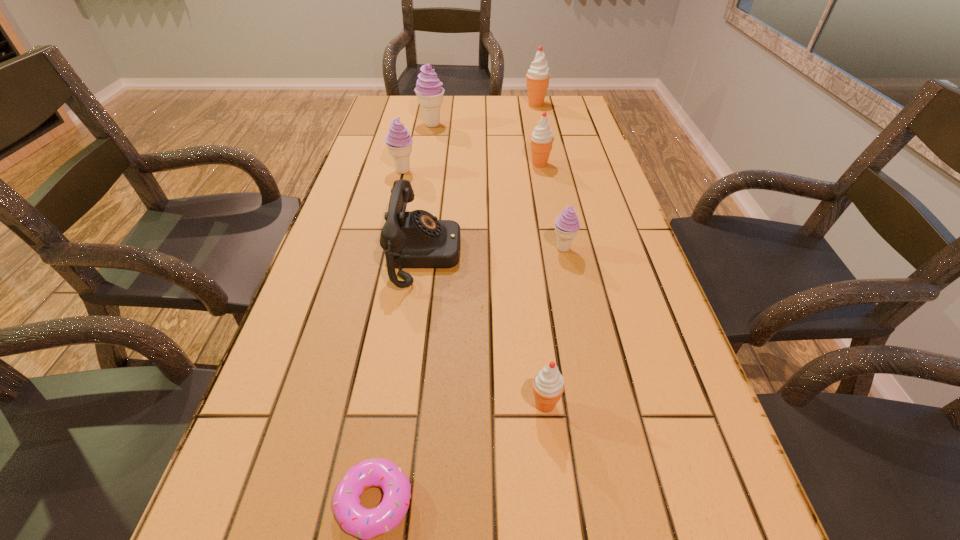
Image resolution: width=960 pixels, height=540 pixels. Find the location of `the nearest icecream`. the nearest icecream is located at coordinates (548, 384).

Find the location of `free location located 0.330m on the left of the farthest object`. free location located 0.330m on the left of the farthest object is located at coordinates (438, 104).

I want to click on vacant region located 0.160m on the back of the biggest purple icecream, so click(436, 101).

Locate an element on the screen. The height and width of the screenshot is (540, 960). free space located 0.140m on the back of the second farthest purple icecream is located at coordinates (410, 143).

The image size is (960, 540). I want to click on vacant space located on the left of the second smallest red icecream, so click(492, 164).

The height and width of the screenshot is (540, 960). I want to click on free location located 0.320m on the dial of the gray telephone, so click(593, 254).

This screenshot has height=540, width=960. Identify the location of free location located on the front of the rightmost purple icecream. (569, 277).

I want to click on blank space located on the back of the smallest red icecream, so click(x=538, y=342).

At what (x,y) coordinates should I click in order to perform the action: click on object present at the left edge. Please return your answer as a coordinate pair (x, y). Looking at the image, I should click on (399, 142).

Where is `object that is at the far right corner`? The height and width of the screenshot is (540, 960). object that is at the far right corner is located at coordinates (538, 76).